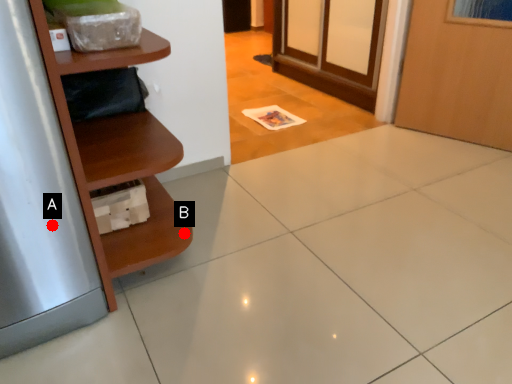
Question: Two points are circled on the image, labeled by A and B beside each circle. Which point appears closest to the camera in this image?

Choices:
 (A) A is closer
 (B) B is closer

Answer: (A)